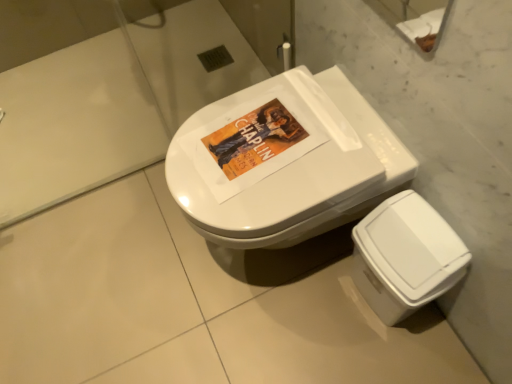
At what (x,y) coordinates should I click in order to perform the action: click on free space above white plastic bidet at lower right (from a real-world perspective). Please return your answer as a coordinate pair (x, y). Looking at the image, I should click on (419, 227).